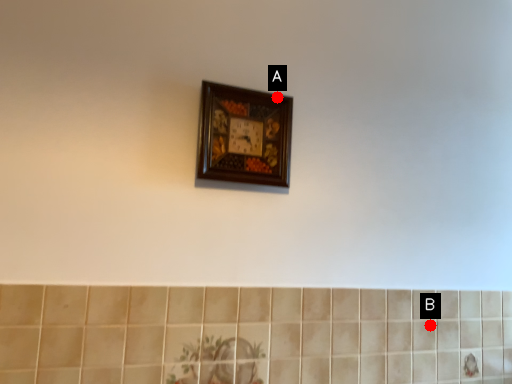
Question: Two points are circled on the image, labeled by A and B beside each circle. Which of the following is the closest to the observer?

Choices:
 (A) A is closer
 (B) B is closer

Answer: (A)